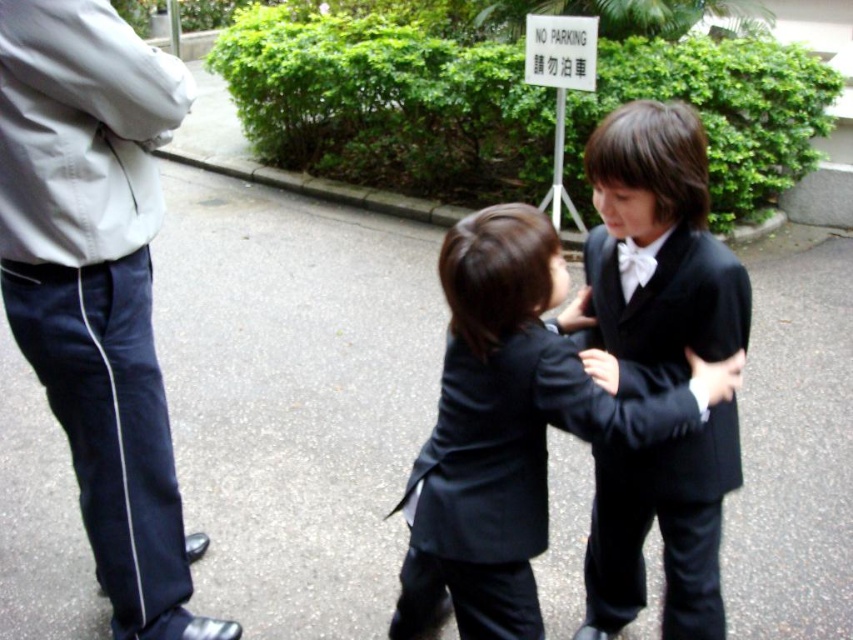
In the scene shown: Is matte black suit at center above black satin suit at center?

Actually, matte black suit at center is below black satin suit at center.

Does matte black suit at center appear on the left side of black satin suit at center?

Correct, you'll find matte black suit at center to the left of black satin suit at center.

Who is more distant from viewer, (506, 472) or (712, 616)?

Positioned behind is point (712, 616).

Where is `matte black suit at center`? The image size is (853, 640). matte black suit at center is located at coordinates (508, 428).

Is white cotton jacket at upper left behind matte black suit at center?

Yes, white cotton jacket at upper left is further from the viewer.

Who is more distant from viewer, (x=119, y=486) or (x=457, y=288)?

The point (x=119, y=486) is behind.

The height and width of the screenshot is (640, 853). What do you see at coordinates (97, 285) in the screenshot? I see `white cotton jacket at upper left` at bounding box center [97, 285].

Where is `white cotton jacket at upper left`? The width and height of the screenshot is (853, 640). white cotton jacket at upper left is located at coordinates (97, 285).

Is matte black suit at center taller than white satin bowtie at center?

Correct, matte black suit at center is much taller as white satin bowtie at center.

Looking at this image, which of these two, matte black suit at center or white satin bowtie at center, stands taller?

matte black suit at center is taller.

Is point (422, 586) more distant than point (642, 268)?

Yes.

Where is `matte black suit at center`? This screenshot has width=853, height=640. matte black suit at center is located at coordinates (508, 428).